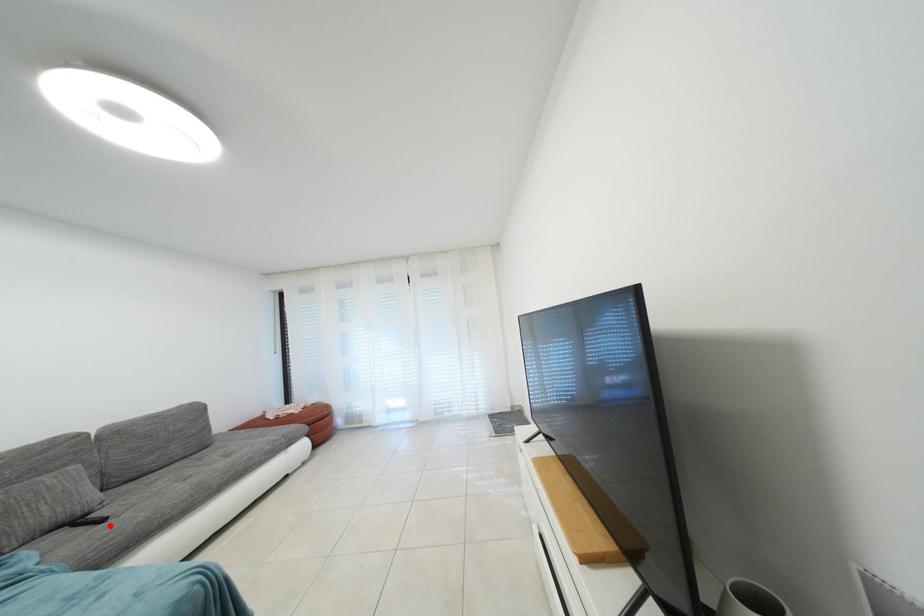
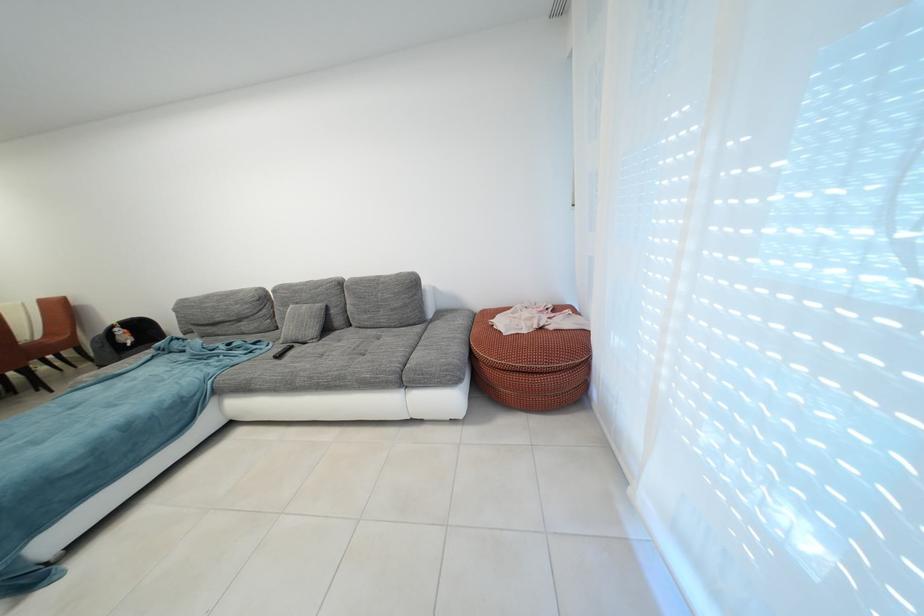
Where in the second image is the point corresponding to the highlighted location from the first image?

(287, 361)